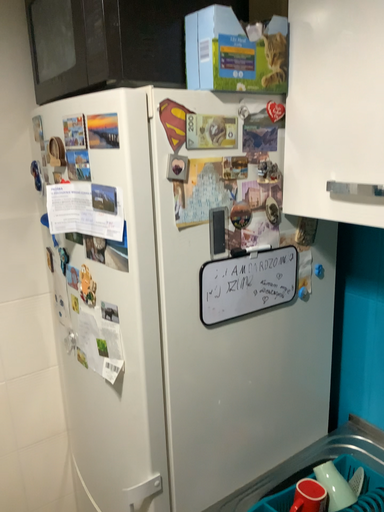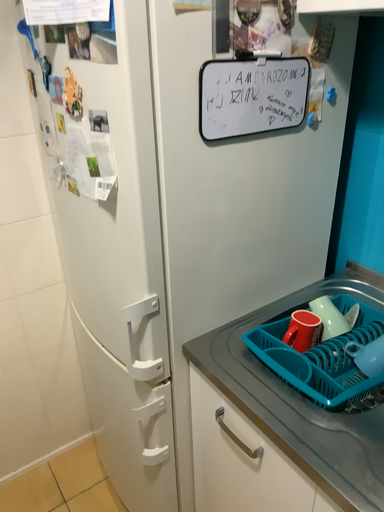
Question: Which way did the camera rotate in the video?

Choices:
 (A) rotated upward
 (B) rotated downward

Answer: (B)